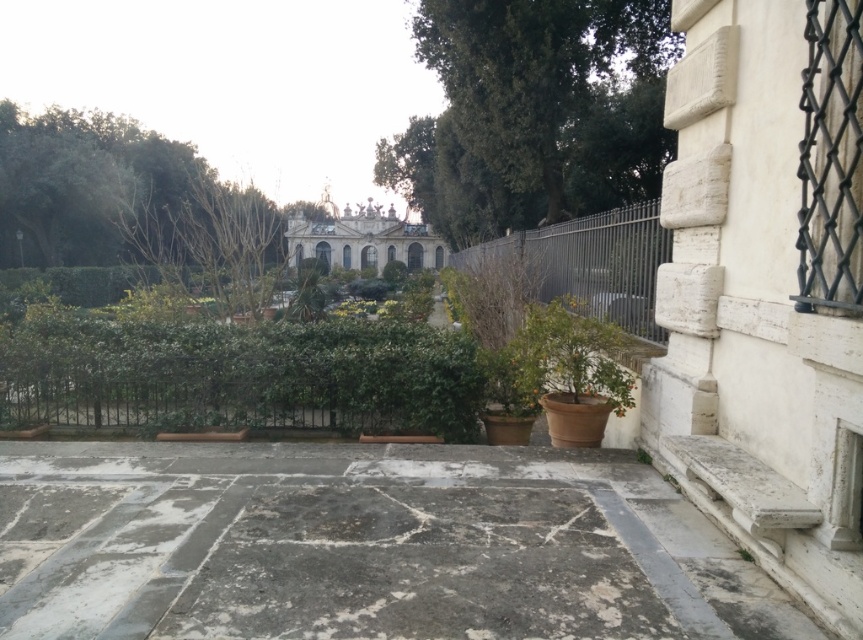
You are standing at the point marked by the coordinates point (364, 547) in the image. What surface are you standing on?

The point (364, 547) corresponds to the gray stone pavement at center, so you are standing on the gray stone pavement at center.

You are a gardener planning to place a large decorative statue that requires a 3x3 meter space. Based on the scene, which object between the gray stone pavement at center and the green leafy hedge at center would be more suitable for placing the statue?

The green leafy hedge at center has a larger size compared to the gray stone pavement at center, so the statue should be placed on the gray stone pavement at center since it is smaller and likely has enough space.